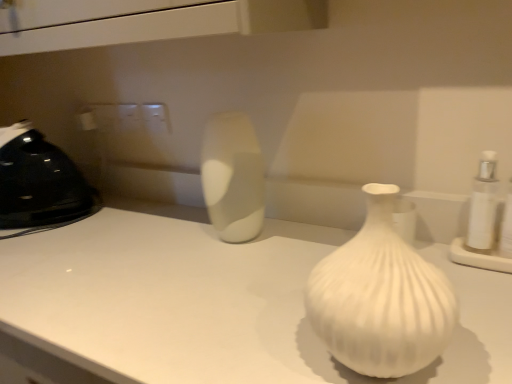
I want to click on white ribbed vase at center, marked as the 2th vase in a back-to-front arrangement, so click(380, 298).

I want to click on black plastic iron at left, so click(40, 183).

At what (x,y) coordinates should I click in order to perform the action: click on white ribbed vase at center, the first vase viewed from the front. Please return your answer as a coordinate pair (x, y). The image size is (512, 384). Looking at the image, I should click on (380, 298).

Considering the relative sizes of white ribbed vase at center, marked as the 2th vase in a back-to-front arrangement, and black plastic iron at left in the image provided, is white ribbed vase at center, marked as the 2th vase in a back-to-front arrangement, taller than black plastic iron at left?

No.

Considering the positions of objects white ribbed vase at center, the first vase viewed from the front, and black plastic iron at left in the image provided, who is more to the left, white ribbed vase at center, the first vase viewed from the front, or black plastic iron at left?

Positioned to the left is black plastic iron at left.

In the scene shown: How different are the orientations of black plastic iron at left and white matte counter top at center in degrees?

The facing directions of black plastic iron at left and white matte counter top at center are 7.92e-06 degrees apart.

Who is bigger, black plastic iron at left or white matte counter top at center?

With larger size is white matte counter top at center.

This screenshot has height=384, width=512. I want to click on counter top lying below the black plastic iron at left (from the image's perspective), so click(215, 304).

Can you confirm if black plastic iron at left is positioned to the left of white matte counter top at center?

Yes, black plastic iron at left is to the left of white matte counter top at center.

Would you say white matte counter top at center is a long distance from white ribbed vase at center, marked as the 2th vase in a back-to-front arrangement?

That's not correct — white matte counter top at center is a little close to white ribbed vase at center, marked as the 2th vase in a back-to-front arrangement.

Is white matte counter top at center completely or partially outside of white ribbed vase at center, the first vase viewed from the front?

Yes.

How distant is white matte counter top at center from white ribbed vase at center, marked as the 2th vase in a back-to-front arrangement?

white matte counter top at center and white ribbed vase at center, marked as the 2th vase in a back-to-front arrangement, are 10.83 inches apart from each other.

In terms of height, does white matte counter top at center look taller or shorter compared to white ribbed vase at center, the first vase viewed from the front?

Clearly, white matte counter top at center is taller compared to white ribbed vase at center, the first vase viewed from the front.

Between satin white vase at center, the first vase from the back, and white matte counter top at center, which one appears on the left side from the viewer's perspective?

Positioned to the left is white matte counter top at center.

Is satin white vase at center, the first vase from the back, positioned far away from white matte counter top at center?

They are positioned close to each other.

Is satin white vase at center, the first vase from the back, turned away from white matte counter top at center?

That's not correct — satin white vase at center, the first vase from the back, is not looking away from white matte counter top at center.

How different are the orientations of satin white vase at center, the first vase from the back, and white matte counter top at center in degrees?

satin white vase at center, the first vase from the back, and white matte counter top at center are facing 8.26e-05 degrees away from each other.

Considering the sizes of objects white matte counter top at center and satin white vase at center, which is the second vase from front to back, in the image provided, who is taller, white matte counter top at center or satin white vase at center, which is the second vase from front to back,?

Standing taller between the two is white matte counter top at center.

From the picture: Considering the sizes of white matte counter top at center and satin white vase at center, which is the second vase from front to back, in the image, is white matte counter top at center wider or thinner than satin white vase at center, which is the second vase from front to back,?

In the image, white matte counter top at center appears to be wider than satin white vase at center, which is the second vase from front to back.

Is satin white vase at center, the first vase from the back, wider than black plastic iron at left?

No.

Which is behind, point (227, 233) or point (50, 151)?

Point (50, 151)

How different are the orientations of satin white vase at center, which is the second vase from front to back, and black plastic iron at left in degrees?

The facing directions of satin white vase at center, which is the second vase from front to back, and black plastic iron at left are 8.16e-05 degrees apart.

Is there a large distance between white matte counter top at center and black plastic iron at left?

No.

Consider the image. From a real-world perspective, who is located higher, white matte counter top at center or black plastic iron at left?

From a 3D spatial view, black plastic iron at left is above.

Does white matte counter top at center turn towards black plastic iron at left?

No, white matte counter top at center is not aimed at black plastic iron at left.

Find the location of `appliance behind the white ribbed vase at center, marked as the 2th vase in a back-to-front arrangement`. appliance behind the white ribbed vase at center, marked as the 2th vase in a back-to-front arrangement is located at coordinates (40, 183).

Locate an element on the screen. This screenshot has height=384, width=512. appliance on the left of white matte counter top at center is located at coordinates (40, 183).

Estimate the real-world distances between objects in this image. Which object is closer to black plastic iron at left, satin white vase at center, which is the second vase from front to back, or white ribbed vase at center, the first vase viewed from the front?

satin white vase at center, which is the second vase from front to back.

Looking at the image, which one is located further to black plastic iron at left, white matte counter top at center or white ribbed vase at center, the first vase viewed from the front?

white ribbed vase at center, the first vase viewed from the front.

Looking at the image, which one is located closer to white matte counter top at center, white ribbed vase at center, the first vase viewed from the front, or black plastic iron at left?

Based on the image, white ribbed vase at center, the first vase viewed from the front, appears to be nearer to white matte counter top at center.

Estimate the real-world distances between objects in this image. Which object is further from black plastic iron at left, white ribbed vase at center, the first vase viewed from the front, or satin white vase at center, the first vase from the back?

white ribbed vase at center, the first vase viewed from the front, lies further to black plastic iron at left than the other object.

Looking at this image, which object lies nearer to the anchor point satin white vase at center, which is the second vase from front to back, black plastic iron at left or white matte counter top at center?

white matte counter top at center.

Based on their spatial positions, is satin white vase at center, the first vase from the back, or black plastic iron at left closer to white matte counter top at center?

Based on the image, satin white vase at center, the first vase from the back, appears to be nearer to white matte counter top at center.

Which object lies further to the anchor point white matte counter top at center, black plastic iron at left or white ribbed vase at center, the first vase viewed from the front?

Among the two, black plastic iron at left is located further to white matte counter top at center.

Estimate the real-world distances between objects in this image. Which object is further from satin white vase at center, which is the second vase from front to back, white ribbed vase at center, marked as the 2th vase in a back-to-front arrangement, or white matte counter top at center?

white ribbed vase at center, marked as the 2th vase in a back-to-front arrangement.

Identify the location of counter top between black plastic iron at left and white ribbed vase at center, the first vase viewed from the front, in the horizontal direction. This screenshot has width=512, height=384. (215, 304).

You are a GUI agent. You are given a task and a screenshot of the screen. Output one action in this format:
    pyautogui.click(x=<x>, y=<y>)
    Task: Click on the counter top between black plastic iron at left and satin white vase at center, which is the second vase from front to back, in the horizontal direction
    This screenshot has height=384, width=512.
    Given the screenshot: What is the action you would take?
    pyautogui.click(x=215, y=304)

What are the coordinates of `vase between satin white vase at center, which is the second vase from front to back, and white matte counter top at center in the up-down direction` in the screenshot? It's located at (380, 298).

The image size is (512, 384). Identify the location of vase situated between black plastic iron at left and white ribbed vase at center, the first vase viewed from the front, from left to right. (233, 177).